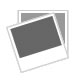
The height and width of the screenshot is (80, 80). In order to click on poloroid pictures in this screenshot , I will do `click(59, 20)`, `click(36, 38)`.